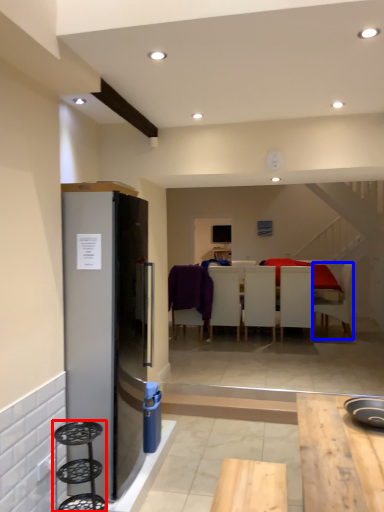
Question: Among these objects, which one is farthest to the camera, bar stool (highlighted by a red box) or chair (highlighted by a blue box)?

Choices:
 (A) bar stool
 (B) chair

Answer: (B)